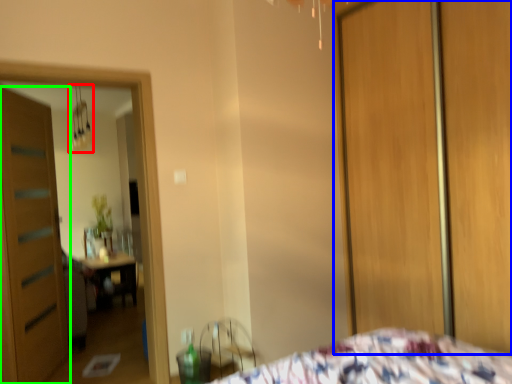
Question: Considering the real-world distances, which object is farthest from light fixture (highlighted by a red box)? screen door (highlighted by a blue box) or door (highlighted by a green box)?

Choices:
 (A) screen door
 (B) door

Answer: (A)